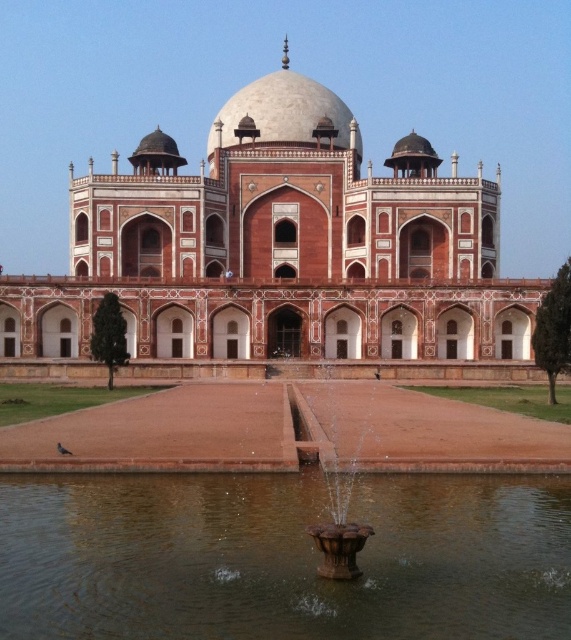
Question: Does reddish-brown stone palace at center have a lesser width compared to brown reflective water at center?

Choices:
 (A) no
 (B) yes

Answer: (A)

Question: Which point is farther to the camera?

Choices:
 (A) reddish-brown stone palace at center
 (B) brown reflective water at center

Answer: (A)

Question: Can you confirm if brown reflective water at center is thinner than bronze metallic fountain at center?

Choices:
 (A) yes
 (B) no

Answer: (B)

Question: Estimate the real-world distances between objects in this image. Which object is closer to the brown reflective water at center?

Choices:
 (A) reddish-brown stone palace at center
 (B) bronze metallic fountain at center

Answer: (B)

Question: Observing the image, what is the correct spatial positioning of reddish-brown stone palace at center in reference to brown reflective water at center?

Choices:
 (A) above
 (B) below

Answer: (A)

Question: Which object is the farthest from the reddish-brown stone palace at center?

Choices:
 (A) brown reflective water at center
 (B) bronze metallic fountain at center

Answer: (A)